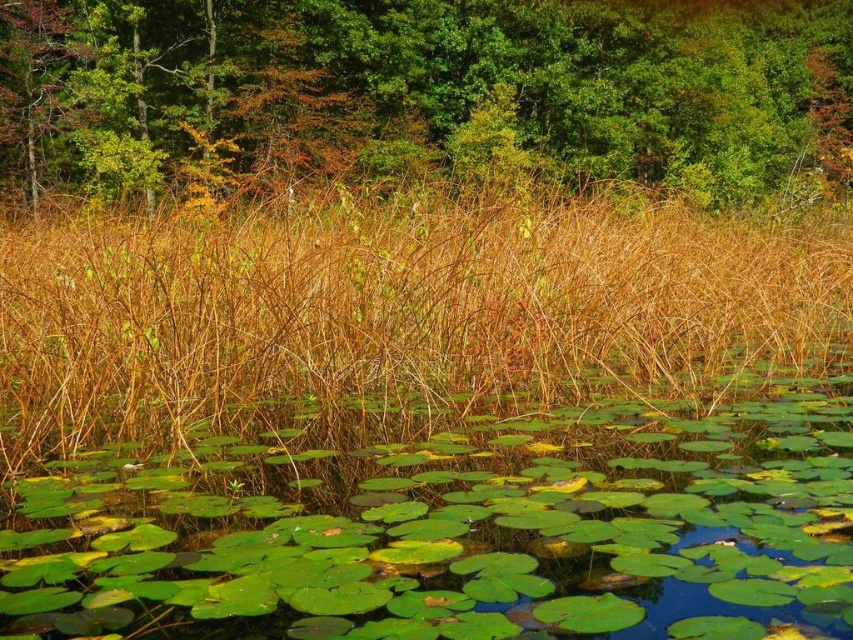
Question: Which object is the farthest from the brown dry grass at center?

Choices:
 (A) green leafy tree at upper center
 (B) green glossy lily pads at center

Answer: (A)

Question: Is green glossy lily pads at center positioned at the back of green leafy tree at upper center?

Choices:
 (A) no
 (B) yes

Answer: (A)

Question: Estimate the real-world distances between objects in this image. Which object is closer to the green leafy tree at upper center?

Choices:
 (A) brown dry grass at center
 (B) green glossy lily pads at center

Answer: (A)

Question: Among these objects, which one is farthest from the camera?

Choices:
 (A) green glossy lily pads at center
 (B) brown dry grass at center

Answer: (B)

Question: Is green glossy lily pads at center closer to camera compared to brown dry grass at center?

Choices:
 (A) no
 (B) yes

Answer: (B)

Question: Is green glossy lily pads at center wider than brown dry grass at center?

Choices:
 (A) no
 (B) yes

Answer: (A)